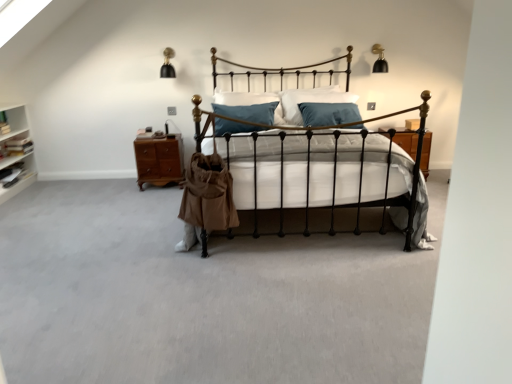
The height and width of the screenshot is (384, 512). I want to click on vacant area that is in front of black wrought iron bed at center, so click(x=266, y=304).